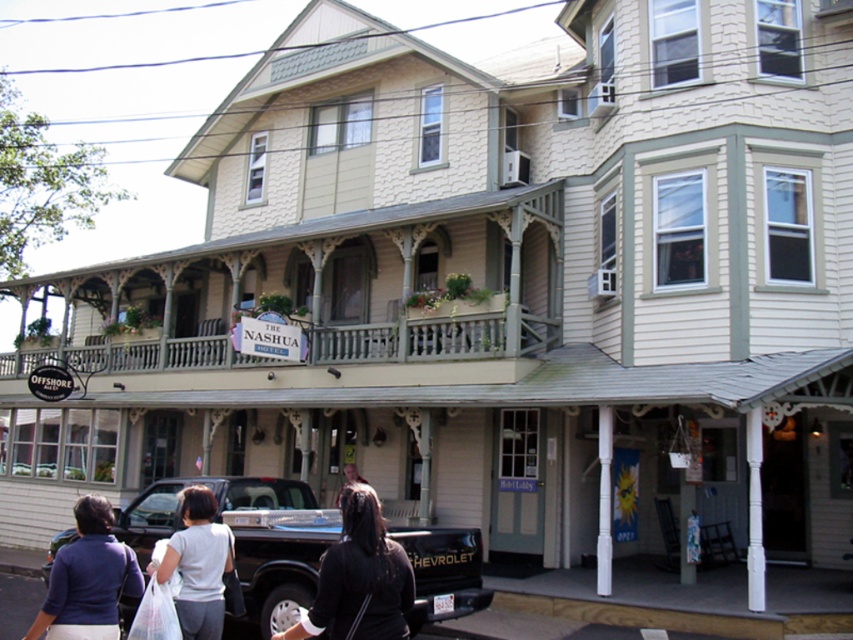
Question: Among these objects, which one is nearest to the camera?

Choices:
 (A) black fabric hair at center
 (B) dark blue sweater at lower left
 (C) wooden porch at center

Answer: (A)

Question: Which of these objects is positioned farthest from the white fabric bag at lower center?

Choices:
 (A) wooden porch at center
 (B) dark blue sweater at lower left

Answer: (A)

Question: Does black matte truck at lower center appear on the left side of white fabric bag at lower center?

Choices:
 (A) no
 (B) yes

Answer: (A)

Question: Is black matte truck at lower center bigger than dark blue sweater at lower left?

Choices:
 (A) yes
 (B) no

Answer: (B)

Question: Which point is farther to the camera?

Choices:
 (A) white fabric bag at lower center
 (B) black fabric hair at center

Answer: (A)

Question: Does black matte truck at lower center have a smaller size compared to dark blue sweater at lower left?

Choices:
 (A) yes
 (B) no

Answer: (A)